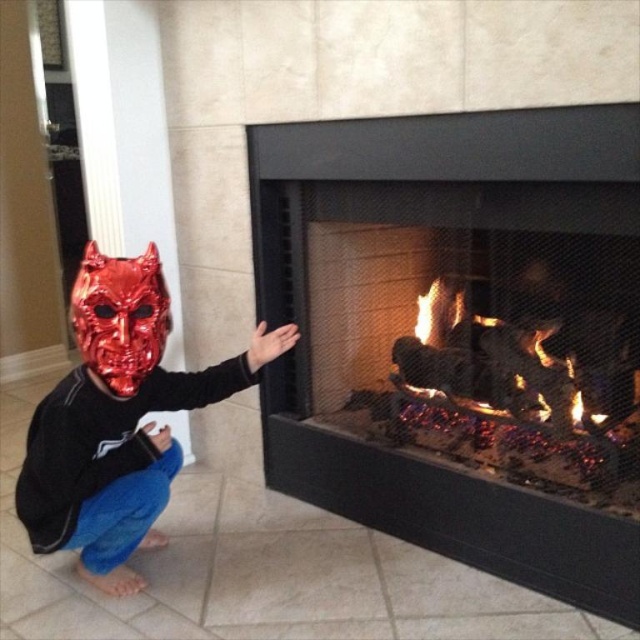
Is shiny metallic mask at left thinner than metallic red mask at left?

Incorrect, shiny metallic mask at left's width is not less than metallic red mask at left's.

Between point (122, 486) and point (132, 372), which one is positioned in front?

Positioned in front is point (132, 372).

Is point (81, 474) positioned before point (106, 342)?

That is False.

Where is `shiny metallic mask at left`? The width and height of the screenshot is (640, 640). shiny metallic mask at left is located at coordinates (118, 419).

Who is more forward, (296, 218) or (92, 275)?

Positioned in front is point (92, 275).

Who is more distant from viewer, (x=612, y=129) or (x=83, y=346)?

Positioned behind is point (x=83, y=346).

Which is behind, point (340, 508) or point (113, 273)?

The point (340, 508) is more distant.

Locate an element on the screen. This screenshot has height=640, width=640. charcoal black fireplace at center is located at coordinates (308, 332).

Does charcoal black fireplace at center appear on the right side of shiny metallic mask at left?

Indeed, charcoal black fireplace at center is positioned on the right side of shiny metallic mask at left.

Between point (305, 400) and point (35, 513), which one is positioned behind?

The point (305, 400) is behind.

Where is `charcoal black fireplace at center`? The width and height of the screenshot is (640, 640). charcoal black fireplace at center is located at coordinates (308, 332).